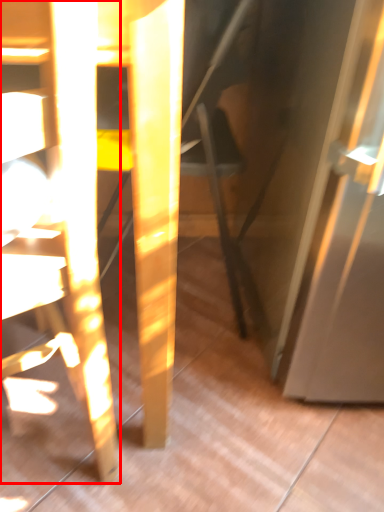
Question: Considering the relative positions of chair (annotated by the red box) and swivel chair in the image provided, where is chair (annotated by the red box) located with respect to the staircase?

Choices:
 (A) left
 (B) right

Answer: (A)